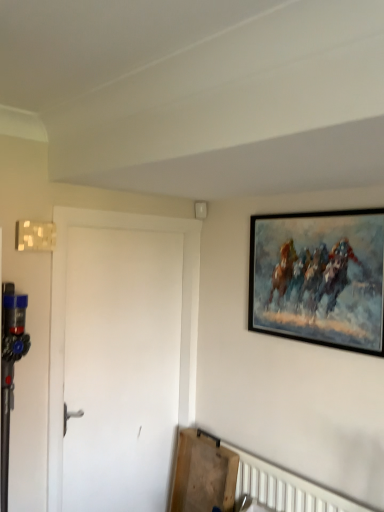
Question: Considering their positions, is white matte door at left located in front of or behind black framed painting at upper right?

Choices:
 (A) behind
 (B) front

Answer: (A)

Question: Is point (134, 297) positioned closer to the camera than point (274, 264)?

Choices:
 (A) farther
 (B) closer

Answer: (A)

Question: From a real-world perspective, is white matte door at left positioned above or below black framed painting at upper right?

Choices:
 (A) below
 (B) above

Answer: (A)

Question: From the image's perspective, is black framed painting at upper right located above or below white matte door at left?

Choices:
 (A) above
 (B) below

Answer: (A)

Question: Is black framed painting at upper right bigger or smaller than white matte door at left?

Choices:
 (A) big
 (B) small

Answer: (B)

Question: In terms of height, does black framed painting at upper right look taller or shorter compared to white matte door at left?

Choices:
 (A) short
 (B) tall

Answer: (A)

Question: Does point (306, 307) appear closer or farther from the camera than point (157, 323)?

Choices:
 (A) farther
 (B) closer

Answer: (B)